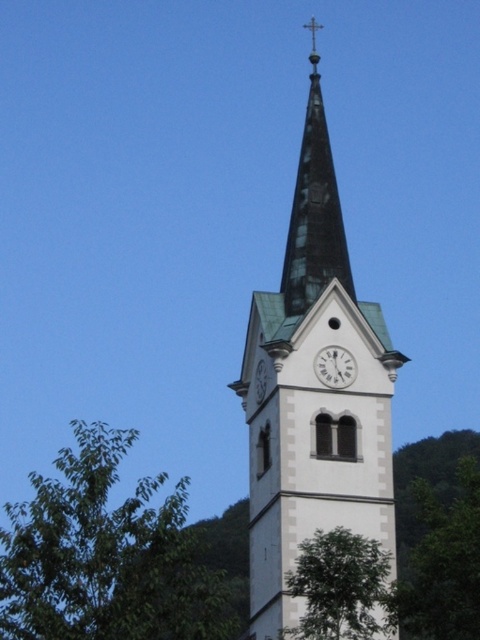
Question: From the image, what is the correct spatial relationship of shiny black glass spire at upper center in relation to white glossy clock at center?

Choices:
 (A) left
 (B) right

Answer: (B)

Question: Which point is closer to the camera?

Choices:
 (A) green leafy tree at lower left
 (B) white smooth clock tower at center
 (C) green leafy tree at lower right

Answer: (A)

Question: Can you confirm if white smooth clock tower at center is positioned above white glossy clock at center?

Choices:
 (A) yes
 (B) no

Answer: (A)

Question: Which object is the closest to the green leafy tree at lower right?

Choices:
 (A) shiny black glass spire at upper center
 (B) white glossy clock at center

Answer: (B)

Question: Which object is positioned farthest from the white metallic clock at center?

Choices:
 (A) green leafy tree at lower right
 (B) white glossy clock at center
 (C) white smooth clock tower at center

Answer: (A)

Question: Does white smooth clock tower at center come in front of white glossy clock at center?

Choices:
 (A) yes
 (B) no

Answer: (A)